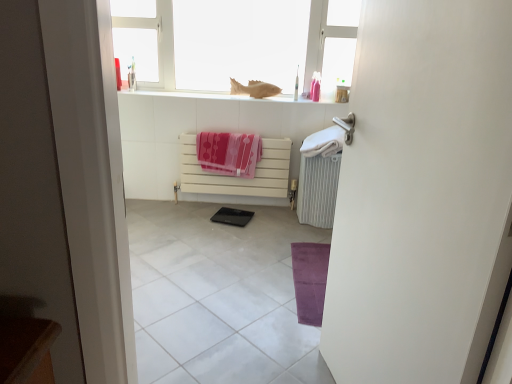
Identify the location of free spot to the right of black glossy pad at center. This screenshot has height=384, width=512. (267, 216).